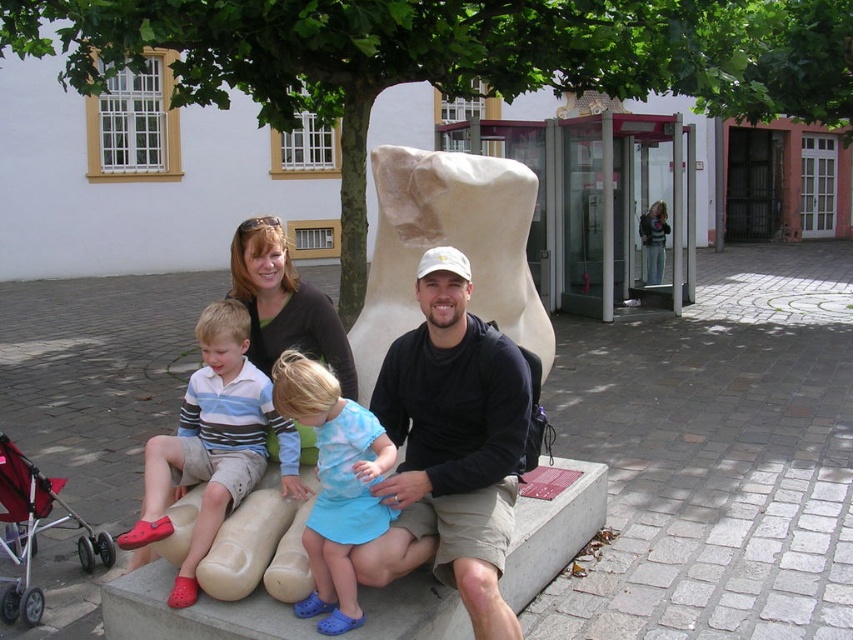
Based on the photo, can you confirm if green leafy tree at upper center is positioned to the right of striped cotton shirt at left?

No, green leafy tree at upper center is not to the right of striped cotton shirt at left.

Between green leafy tree at upper center and striped cotton shirt at left, which one appears on the left side from the viewer's perspective?

green leafy tree at upper center is more to the left.

Who is more forward, (x=68, y=33) or (x=248, y=339)?

Point (x=248, y=339)

Locate an element on the screen. The image size is (853, 640). green leafy tree at upper center is located at coordinates (450, 58).

Is point (195, 456) farther from viewer compared to point (378, 461)?

Yes, point (195, 456) is farther from viewer.

Who is lower down, striped cotton shirt at left or blue fabric dress at center?

blue fabric dress at center is below.

The image size is (853, 640). Describe the element at coordinates (213, 444) in the screenshot. I see `striped cotton shirt at left` at that location.

What are the coordinates of `striped cotton shirt at left` in the screenshot? It's located at (213, 444).

You are a GUI agent. You are given a task and a screenshot of the screen. Output one action in this format:
    pyautogui.click(x=<x>, y=<y>)
    Task: Click on the black matte shirt at center
    The image size is (853, 640).
    Given the screenshot: What is the action you would take?
    pyautogui.click(x=451, y=445)

Between black matte shirt at center and striped cotton shirt at left, which one has more height?

Standing taller between the two is black matte shirt at center.

Is point (387, 563) less distant than point (190, 410)?

That is True.

Find the location of a particular element. The image size is (853, 640). black matte shirt at center is located at coordinates (451, 445).